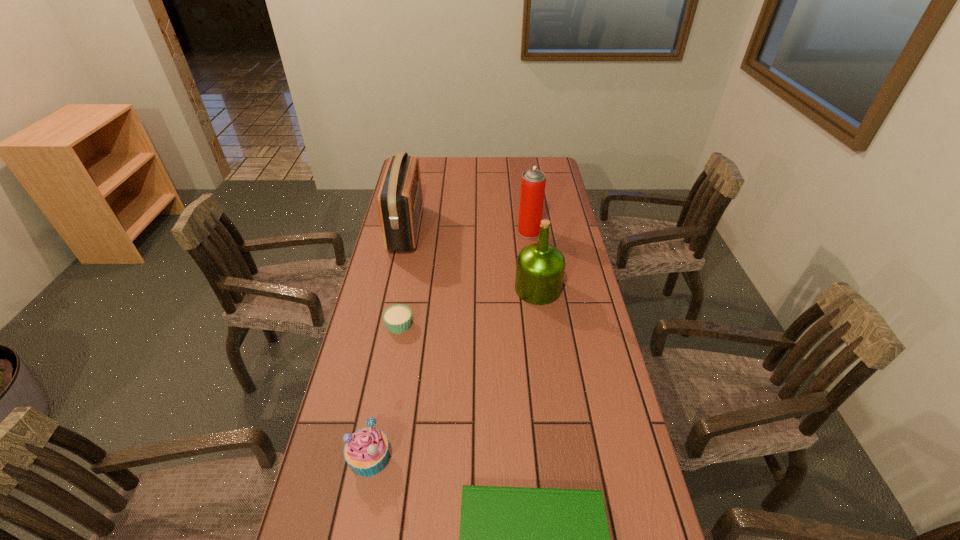
The image size is (960, 540). I want to click on free space located on the back of the fourth tallest object, so click(x=393, y=340).

Where is `blank space located 0.120m on the front of the cupcake`? This screenshot has height=540, width=960. blank space located 0.120m on the front of the cupcake is located at coordinates (391, 368).

Image resolution: width=960 pixels, height=540 pixels. What are the coordinates of `radio receiver that is at the left edge` in the screenshot? It's located at (400, 200).

Where is `muffin that is at the left edge`? The image size is (960, 540). muffin that is at the left edge is located at coordinates (366, 450).

The image size is (960, 540). What are the coordinates of `cupcake present at the left edge` in the screenshot? It's located at (397, 318).

Where is `aerosol can that is at the right edge`? aerosol can that is at the right edge is located at coordinates (533, 181).

This screenshot has height=540, width=960. In order to click on olive oil present at the right edge in this screenshot , I will do `click(540, 267)`.

This screenshot has width=960, height=540. In order to click on vacant space at the far edge of the desktop in this screenshot , I will do `click(482, 158)`.

This screenshot has height=540, width=960. In order to click on vacant space at the left edge in this screenshot , I will do `click(322, 482)`.

This screenshot has width=960, height=540. I want to click on free location at the right edge, so click(x=603, y=455).